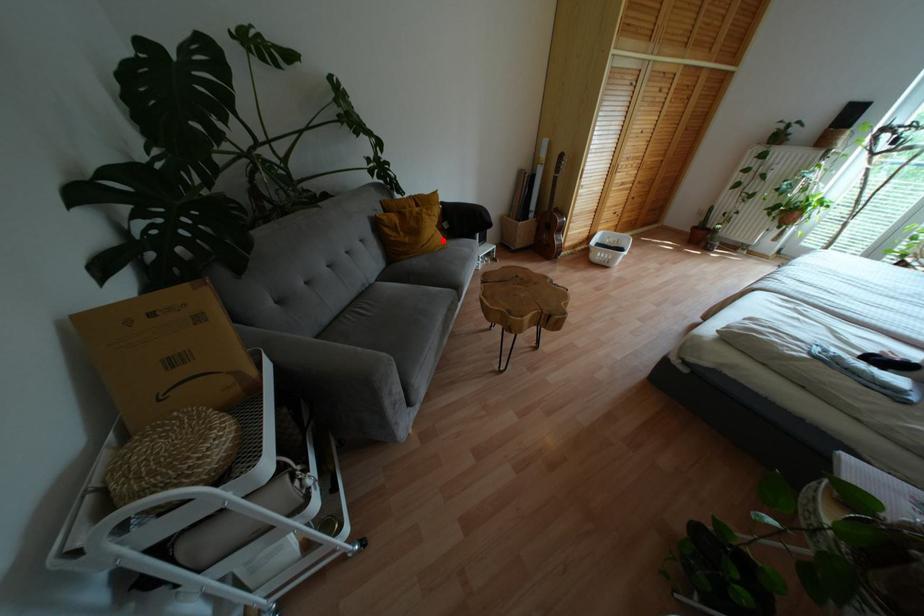
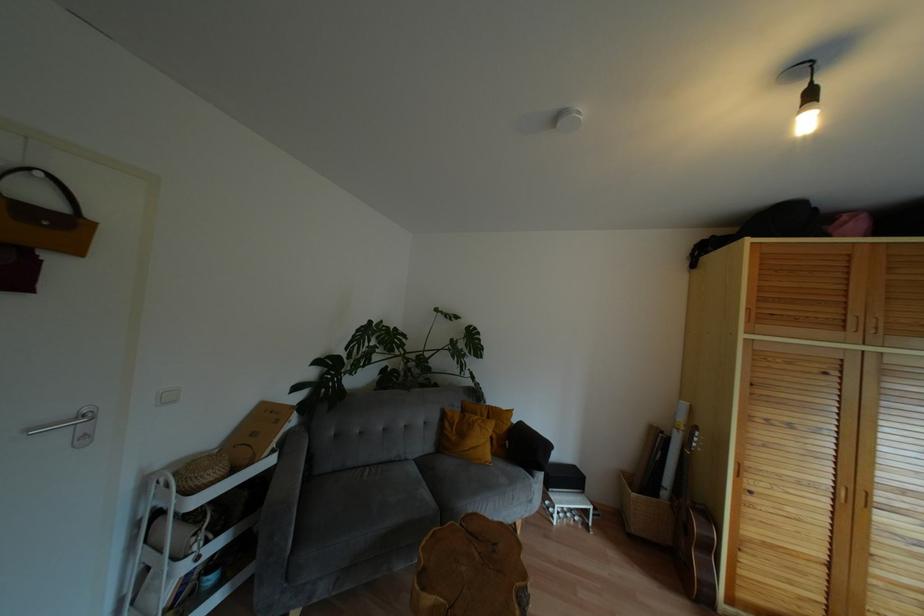
Question: I am providing you with two images of the same scene from different viewpoints. In image1, a red point is highlighted. Considering the same 3D point in image2, which of the following is correct?

Choices:
 (A) It is closer
 (B) It is farther

Answer: (B)